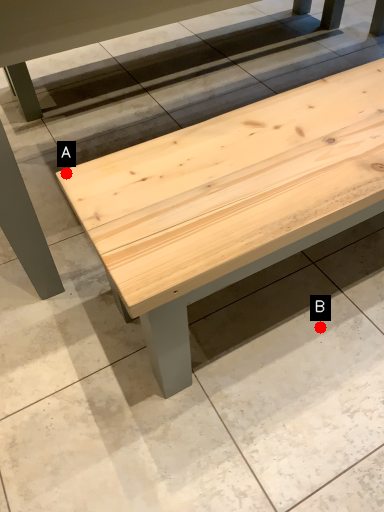
Question: Two points are circled on the image, labeled by A and B beside each circle. Which of the following is the closest to the observer?

Choices:
 (A) A is closer
 (B) B is closer

Answer: (A)